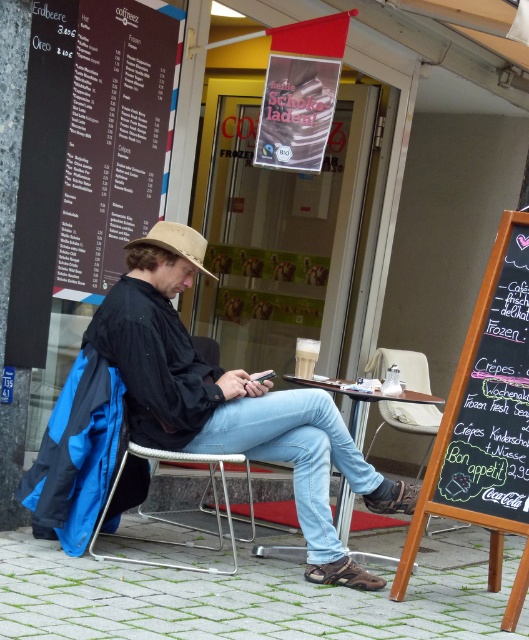
Is the position of denim jeans at center more distant than that of black chalkboard at right?

Yes, it is behind black chalkboard at right.

The image size is (529, 640). I want to click on denim jeans at center, so click(x=232, y=410).

What do you see at coordinates (232, 410) in the screenshot?
I see `denim jeans at center` at bounding box center [232, 410].

You are a GUI agent. You are given a task and a screenshot of the screen. Output one action in this format:
    pyautogui.click(x=<x>, y=<y>)
    Task: Click on the denim jeans at center
    The width and height of the screenshot is (529, 640).
    Given the screenshot: What is the action you would take?
    pyautogui.click(x=232, y=410)

Consider the image. Does denim jeans at center appear on the left side of beige fabric fedora at center?

In fact, denim jeans at center is to the right of beige fabric fedora at center.

Between denim jeans at center and beige fabric fedora at center, which one is positioned higher?

beige fabric fedora at center

This screenshot has width=529, height=640. Describe the element at coordinates (232, 410) in the screenshot. I see `denim jeans at center` at that location.

Locate an element on the screen. The height and width of the screenshot is (640, 529). denim jeans at center is located at coordinates (232, 410).

You are a GUI agent. You are given a task and a screenshot of the screen. Output one action in this format:
    pyautogui.click(x=<x>, y=<y>)
    Task: Click on the denim jeans at center
    The width and height of the screenshot is (529, 640).
    Given the screenshot: What is the action you would take?
    pyautogui.click(x=232, y=410)

Does point (156, 291) come farther from viewer compared to point (418, 468)?

No.

Between point (177, 282) and point (433, 426), which one is positioned in front?

Point (177, 282) is in front.

Where is `denim jeans at center`? The height and width of the screenshot is (640, 529). denim jeans at center is located at coordinates (232, 410).